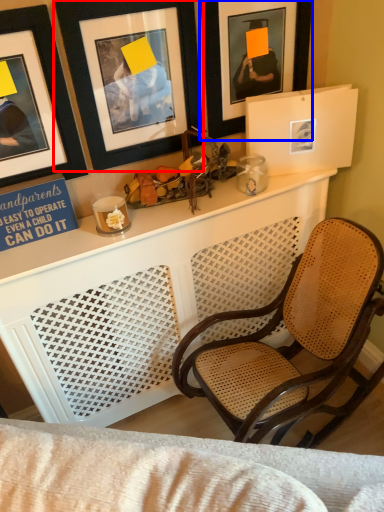
Question: Which object appears closest to the camera in this image, picture frame (highlighted by a red box) or picture frame (highlighted by a blue box)?

Choices:
 (A) picture frame
 (B) picture frame

Answer: (A)